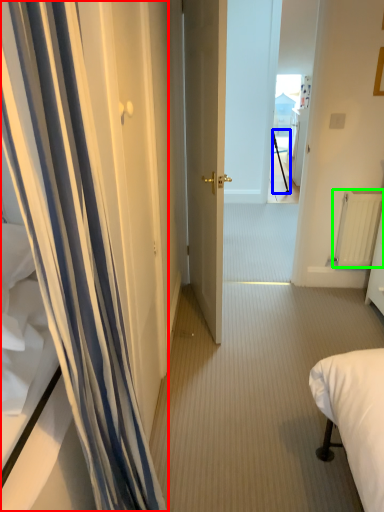
Question: Which object is positioned farthest from curtain (highlighted by a red box)? Select from tripod (highlighted by a blue box) and radiator (highlighted by a green box).

Choices:
 (A) tripod
 (B) radiator

Answer: (A)